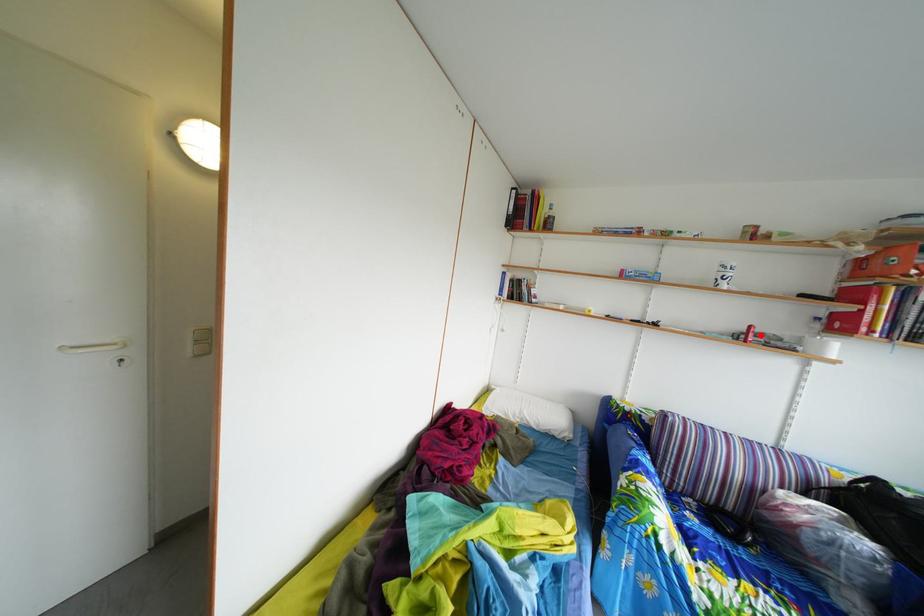
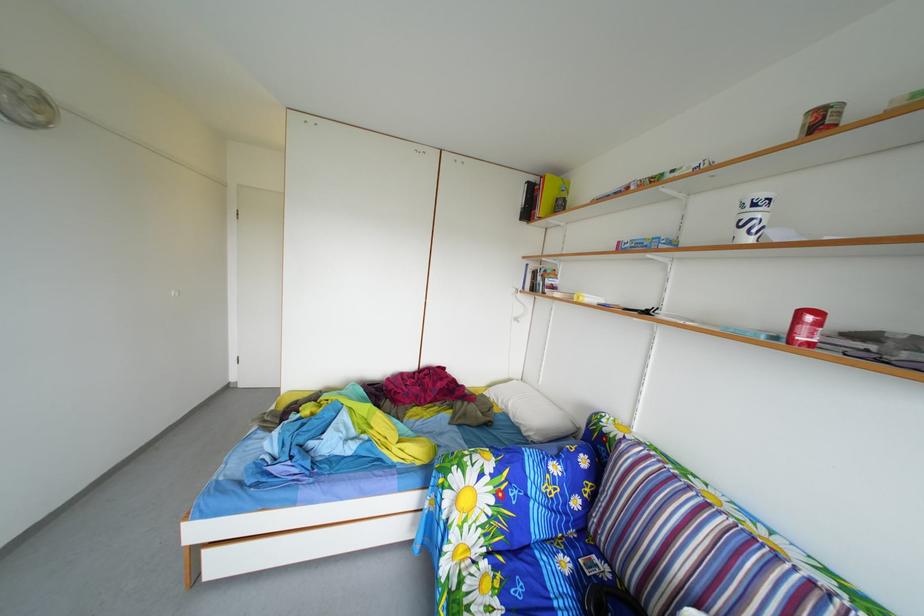
Question: I am providing you with two images of the same scene from different viewpoints. A red point is marked on the first image. Is the red point's position out of view in image 2?

Choices:
 (A) Yes
 (B) No

Answer: (B)